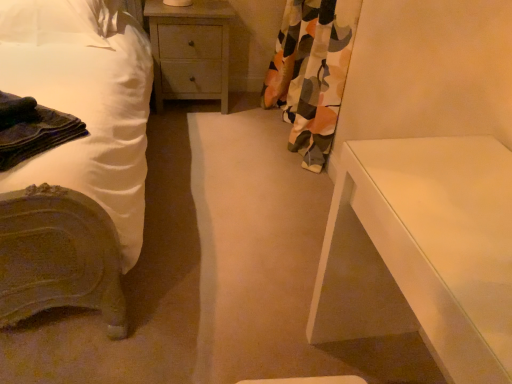
Question: Should I look upward or downward to see white fabric pillow at upper left?

Choices:
 (A) up
 (B) down

Answer: (A)

Question: From a real-world perspective, is white matte bed at left over dark blue fabric at left?

Choices:
 (A) no
 (B) yes

Answer: (A)

Question: Is white matte bed at left far from dark blue fabric at left?

Choices:
 (A) yes
 (B) no

Answer: (B)

Question: From the image's perspective, is white matte bed at left over dark blue fabric at left?

Choices:
 (A) no
 (B) yes

Answer: (B)

Question: From a real-world perspective, does white matte bed at left sit lower than dark blue fabric at left?

Choices:
 (A) no
 (B) yes

Answer: (B)

Question: Can you confirm if white matte bed at left is shorter than dark blue fabric at left?

Choices:
 (A) no
 (B) yes

Answer: (A)

Question: Is white matte bed at left facing away from dark blue fabric at left?

Choices:
 (A) no
 (B) yes

Answer: (A)

Question: Considering the relative sizes of dark blue fabric at left and floral fabric curtain at right in the image provided, is dark blue fabric at left bigger than floral fabric curtain at right?

Choices:
 (A) no
 (B) yes

Answer: (A)

Question: Is dark blue fabric at left oriented away from floral fabric curtain at right?

Choices:
 (A) no
 (B) yes

Answer: (B)

Question: Would you say dark blue fabric at left is outside floral fabric curtain at right?

Choices:
 (A) yes
 (B) no

Answer: (A)

Question: Would you say dark blue fabric at left is a long distance from floral fabric curtain at right?

Choices:
 (A) no
 (B) yes

Answer: (B)

Question: Is dark blue fabric at left at the left side of floral fabric curtain at right?

Choices:
 (A) yes
 (B) no

Answer: (A)

Question: Would you say dark blue fabric at left contains floral fabric curtain at right?

Choices:
 (A) no
 (B) yes

Answer: (A)

Question: Can you confirm if white fabric pillow at upper left is shorter than dark blue fabric at left?

Choices:
 (A) no
 (B) yes

Answer: (A)